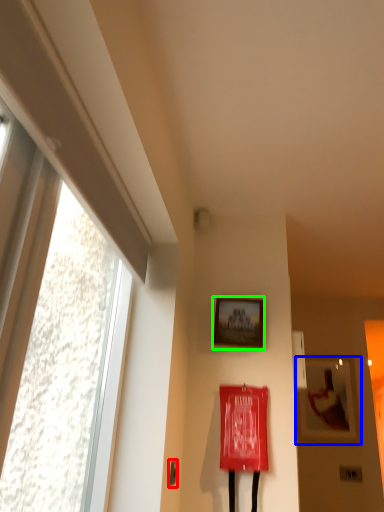
Question: Based on their relative distances, which object is farther from door handle (highlighted by a red box)? Choose from picture frame (highlighted by a blue box) and picture frame (highlighted by a green box).

Choices:
 (A) picture frame
 (B) picture frame

Answer: (A)